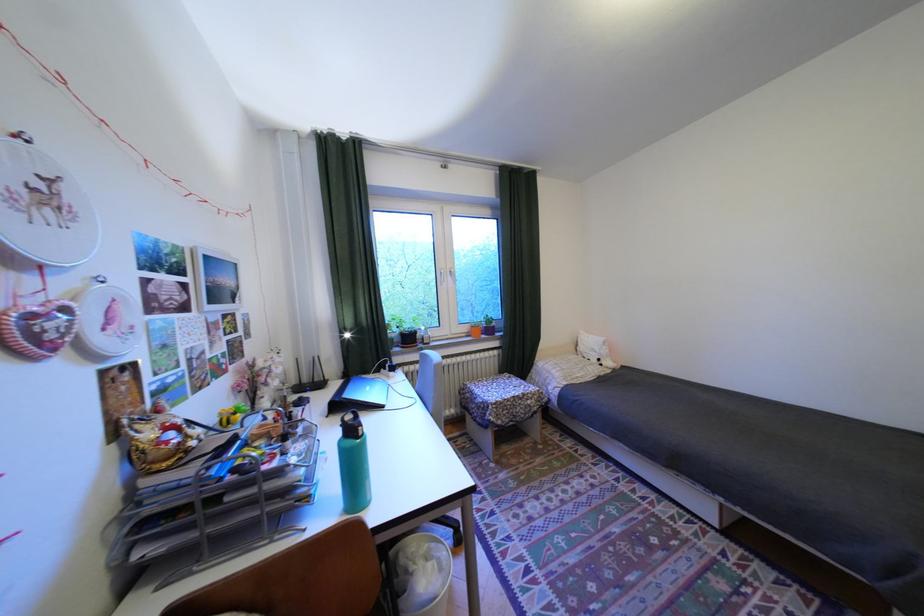
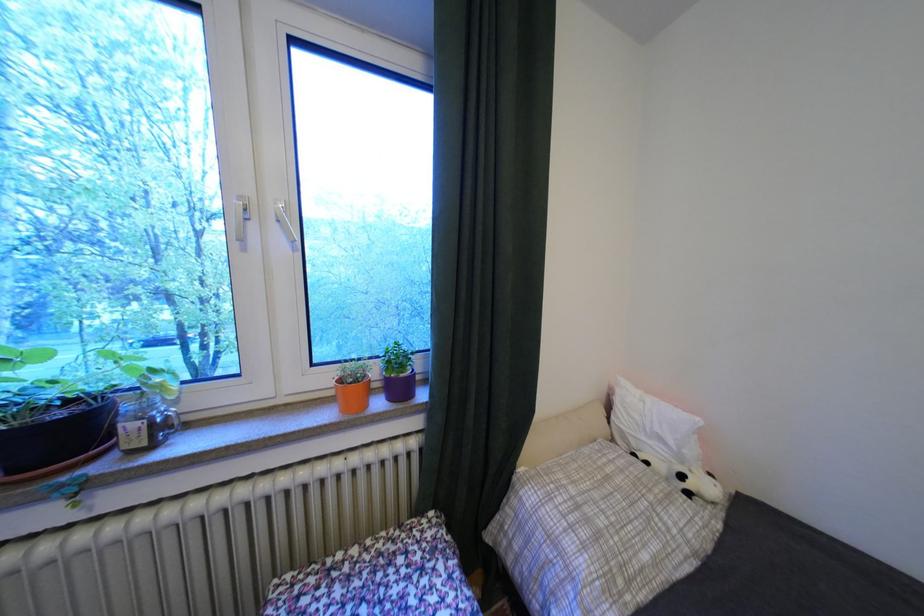
The point at [593,377] is marked in the first image. Where is the corresponding point in the second image?

(667, 562)